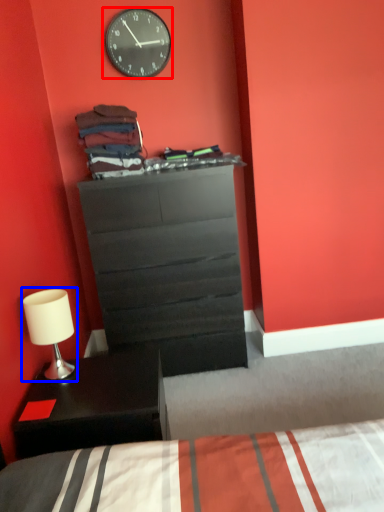
Question: Among these objects, which one is nearest to the camera, wall clock (highlighted by a red box) or table lamp (highlighted by a blue box)?

Choices:
 (A) wall clock
 (B) table lamp

Answer: (B)